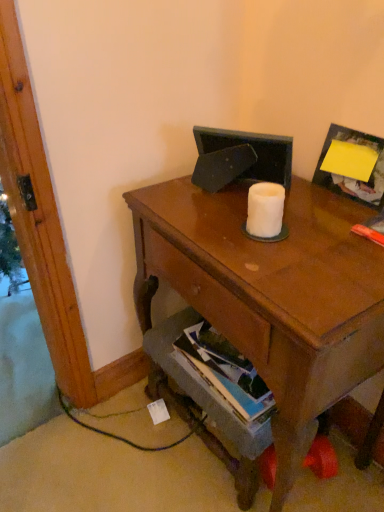
Where is `vacant area situated to the left side of white matte toilet paper at center`? The image size is (384, 512). vacant area situated to the left side of white matte toilet paper at center is located at coordinates (201, 226).